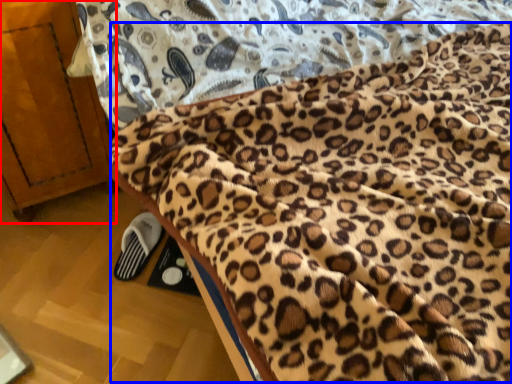
Question: Among these objects, which one is farthest to the camera, furniture (highlighted by a red box) or blanket (highlighted by a blue box)?

Choices:
 (A) furniture
 (B) blanket

Answer: (A)